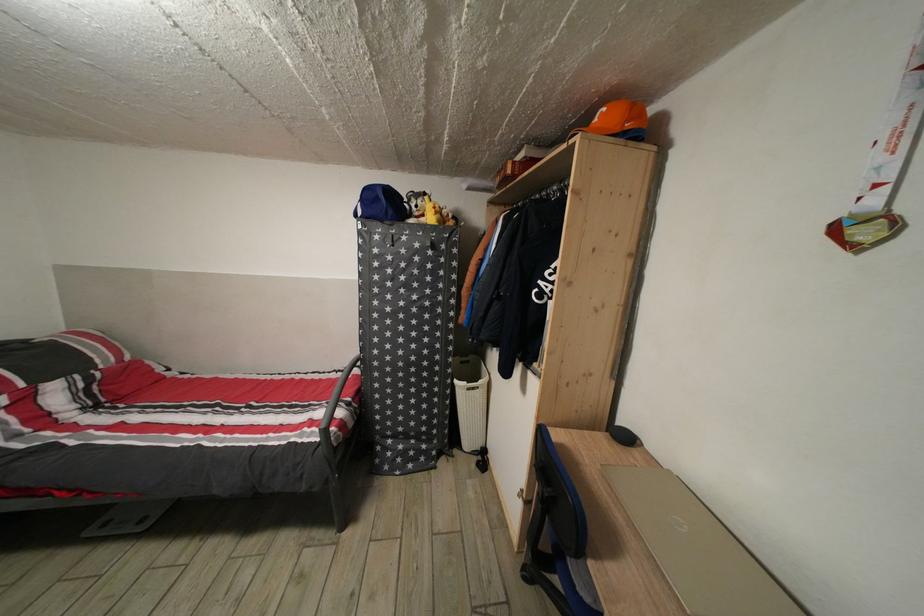
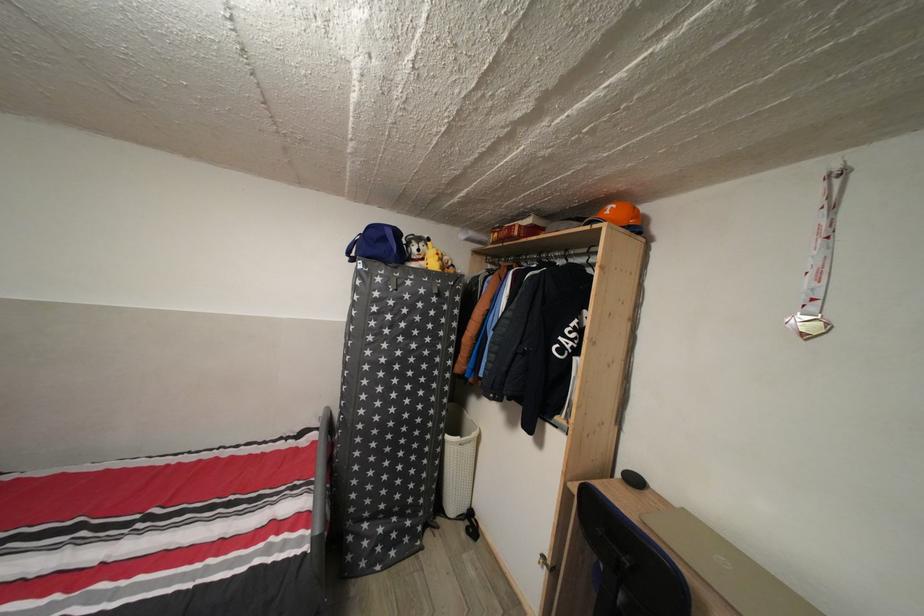
Locate, in the second image, the point that corresponds to the point at 602,126 in the first image.

(614, 219)